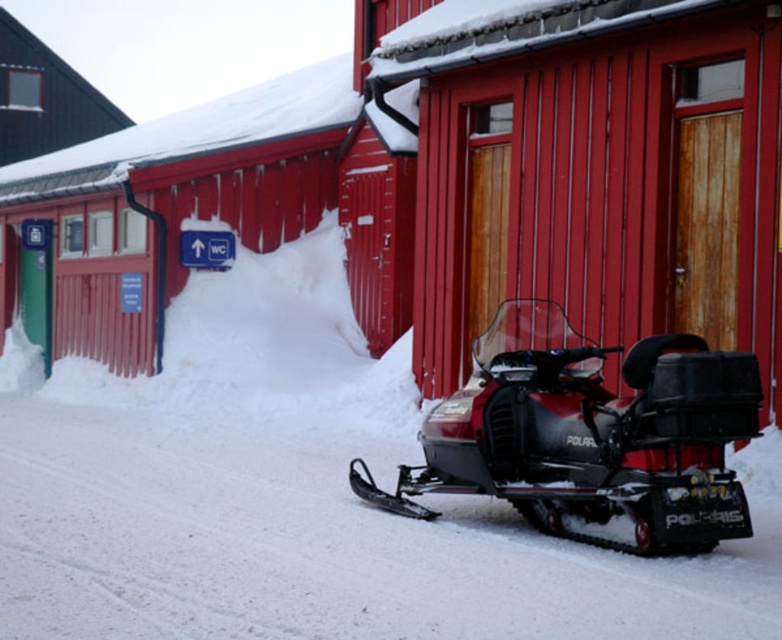
You are a delivery person needing to enter the smooth wood door at center to deliver a package. However, your delivery truck is parked near the shiny black snowmobile at center. Considering the width of both objects, which one is narrower and can fit through a narrow path?

The smooth wood door at center has a lesser width compared to the shiny black snowmobile at center, so the smooth wood door at center is narrower and can fit through a narrow path.